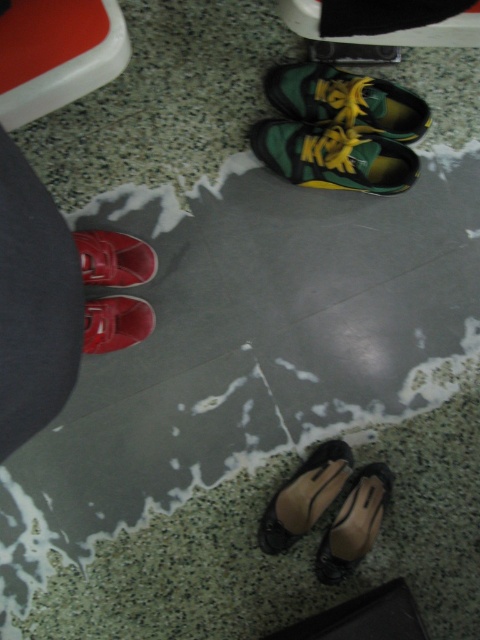
Is shiny black high-heeled shoe at lower center to the left of matte red shoe at lower left from the viewer's perspective?

Incorrect, shiny black high-heeled shoe at lower center is not on the left side of matte red shoe at lower left.

Find the location of a particular element. This screenshot has width=480, height=640. shiny black high-heeled shoe at lower center is located at coordinates (304, 497).

Does green matte shoe at upper center have a greater height compared to matte red shoe at lower left?

Yes.

Is green matte shoe at upper center wider than matte red shoe at lower left?

Yes.

Which is behind, point (407, 131) or point (88, 310)?

Point (407, 131)

Find the location of `green matte shoe at upper center`. green matte shoe at upper center is located at coordinates (347, 100).

Describe the element at coordinates (355, 524) in the screenshot. The height and width of the screenshot is (640, 480). I see `shiny black shoe at lower center` at that location.

Who is more forward, (346, 568) or (120, 278)?

Point (120, 278) is in front.

Identify the location of shiny black shoe at lower center. This screenshot has width=480, height=640. (355, 524).